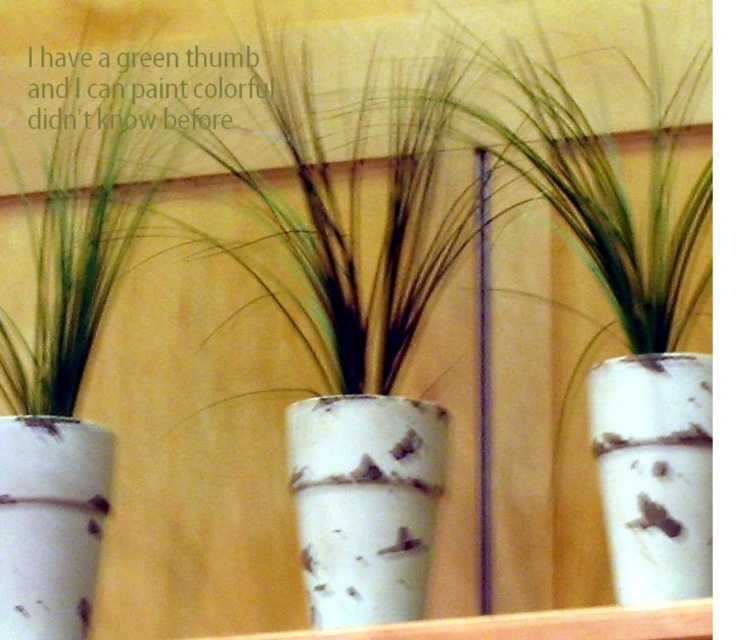
Does green leafy plant at center have a greater height compared to white speckled vase at center?

Yes, green leafy plant at center is taller than white speckled vase at center.

From the picture: Who is more distant from viewer, (61, 132) or (413, 486)?

Positioned behind is point (61, 132).

Is point (73, 348) closer to camera compared to point (414, 616)?

No.

The width and height of the screenshot is (748, 640). In order to click on green leafy plant at center in this screenshot , I will do `click(82, 228)`.

Is white speckled vase at center to the left of white textured vase at left from the viewer's perspective?

In fact, white speckled vase at center is to the right of white textured vase at left.

Which is more to the left, white speckled vase at center or white textured vase at left?

white textured vase at left is more to the left.

Between point (408, 516) and point (7, 588), which one is positioned behind?

Point (408, 516)

Find the location of a particular element. The height and width of the screenshot is (640, 748). white speckled vase at center is located at coordinates (364, 502).

Between white textured vase at center and white textured vase at left, which one is positioned lower?

white textured vase at left is lower down.

Describe the element at coordinates (654, 472) in the screenshot. The image size is (748, 640). I see `white textured vase at center` at that location.

The height and width of the screenshot is (640, 748). I want to click on white textured vase at center, so click(654, 472).